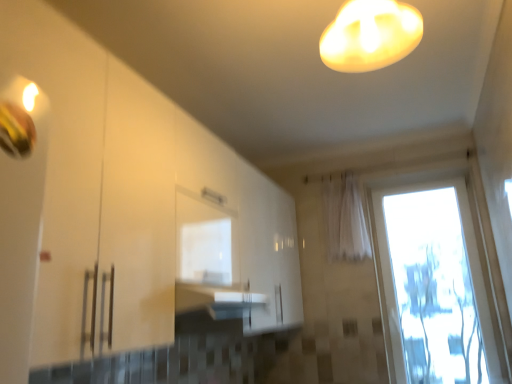
In order to click on transparent glass door at right in this screenshot , I will do `click(432, 281)`.

What is the approximate width of transparent glass door at right?

It is 6.27 inches.

Identify the location of white sheer curtain at center. The image size is (512, 384). (345, 218).

Find the location of a particular element. This screenshot has height=384, width=512. white glossy lampshade at upper center is located at coordinates (370, 35).

Is point (353, 176) positioned before point (368, 31)?

No, (353, 176) is behind (368, 31).

Is white sheer curtain at center taller than white glossy lampshade at upper center?

Correct, white sheer curtain at center is much taller as white glossy lampshade at upper center.

Is white glossy lampshade at upper center facing towards white glossy cabinet at center?

No, white glossy lampshade at upper center is not aimed at white glossy cabinet at center.

Consider the image. Which object is further away from the camera taking this photo, white glossy lampshade at upper center or white glossy cabinet at center?

Positioned behind is white glossy lampshade at upper center.

From a real-world perspective, which is physically above, white glossy lampshade at upper center or white glossy cabinet at center?

From a 3D spatial view, white glossy lampshade at upper center is above.

From a real-world perspective, is white glossy lampshade at upper center located beneath white sheer curtain at center?

No, from a real-world perspective, white glossy lampshade at upper center is not under white sheer curtain at center.

Considering the sizes of white glossy lampshade at upper center and white sheer curtain at center in the image, is white glossy lampshade at upper center bigger or smaller than white sheer curtain at center?

Clearly, white glossy lampshade at upper center is smaller in size than white sheer curtain at center.

Is white sheer curtain at center surrounded by white glossy lampshade at upper center?

No, white sheer curtain at center is not inside white glossy lampshade at upper center.

Which is farther from the camera, (397, 57) or (328, 224)?

The point (328, 224) is farther.

Is transparent glass door at right positioned before white sheer curtain at center?

Yes, transparent glass door at right is in front of white sheer curtain at center.

Measure the distance between transparent glass door at right and white sheer curtain at center.

18.47 inches.

Identify the location of curtain above the transparent glass door at right (from the image's perspective). (345, 218).

What's the angular difference between transparent glass door at right and white sheer curtain at center's facing directions?

The angle between the facing direction of transparent glass door at right and the facing direction of white sheer curtain at center is 0.324 degrees.

Between white glossy cabinet at center and white sheer curtain at center, which one appears on the right side from the viewer's perspective?

From the viewer's perspective, white sheer curtain at center appears more on the right side.

Is white glossy cabinet at center aimed at white sheer curtain at center?

Yes, white glossy cabinet at center is aimed at white sheer curtain at center.

Which of these two, white glossy cabinet at center or white sheer curtain at center, stands shorter?

With less height is white sheer curtain at center.

This screenshot has width=512, height=384. In order to click on curtain above the white glossy cabinet at center (from the image's perspective) in this screenshot , I will do `click(345, 218)`.

Measure the distance between transparent glass door at right and white glossy lampshade at upper center.

transparent glass door at right is 6.44 feet away from white glossy lampshade at upper center.

Is transparent glass door at right far from white glossy lampshade at upper center?

Yes, transparent glass door at right and white glossy lampshade at upper center are located far from each other.

From a real-world perspective, between transparent glass door at right and white glossy lampshade at upper center, who is vertically higher?

white glossy lampshade at upper center.

Is transparent glass door at right shorter than white glossy lampshade at upper center?

Incorrect, the height of transparent glass door at right does not fall short of that of white glossy lampshade at upper center.

From the image's perspective, which is below, white sheer curtain at center or transparent glass door at right?

From the image's view, transparent glass door at right is below.

Based on the photo, is the surface of white sheer curtain at center in direct contact with transparent glass door at right?

No, white sheer curtain at center is not next to transparent glass door at right.

Is white sheer curtain at center positioned with its back to transparent glass door at right?

No, transparent glass door at right is not at the back of white sheer curtain at center.

In order to click on curtain located below the white glossy lampshade at upper center (from the image's perspective) in this screenshot , I will do `click(345, 218)`.

You are a GUI agent. You are given a task and a screenshot of the screen. Output one action in this format:
    pyautogui.click(x=<x>, y=<y>)
    Task: Click on the cabinetry lying in front of the white glossy lampshade at upper center
    This screenshot has width=512, height=384.
    Given the screenshot: What is the action you would take?
    pyautogui.click(x=169, y=231)

When comparing their distances from transparent glass door at right, does white glossy cabinet at center or white glossy lampshade at upper center seem further?

white glossy lampshade at upper center is positioned further to the anchor transparent glass door at right.

When comparing their distances from white glossy lampshade at upper center, does white sheer curtain at center or transparent glass door at right seem further?

Based on the image, transparent glass door at right appears to be further to white glossy lampshade at upper center.

Estimate the real-world distances between objects in this image. Which object is further from white sheer curtain at center, transparent glass door at right or white glossy cabinet at center?

The object further to white sheer curtain at center is white glossy cabinet at center.

From the image, which object appears to be farther from white sheer curtain at center, white glossy lampshade at upper center or white glossy cabinet at center?

Based on the image, white glossy lampshade at upper center appears to be further to white sheer curtain at center.

Considering their positions, is transparent glass door at right positioned closer to white glossy cabinet at center than white sheer curtain at center?

white sheer curtain at center is positioned closer to the anchor white glossy cabinet at center.

Considering their positions, is white glossy lampshade at upper center positioned closer to white glossy cabinet at center than white sheer curtain at center?

white glossy lampshade at upper center.

When comparing their distances from white glossy lampshade at upper center, does white sheer curtain at center or white glossy cabinet at center seem closer?

white glossy cabinet at center is closer to white glossy lampshade at upper center.

Which object lies nearer to the anchor point transparent glass door at right, white glossy lampshade at upper center or white glossy cabinet at center?

white glossy cabinet at center.

Locate an element on the screen. The image size is (512, 384). window located between white glossy cabinet at center and white sheer curtain at center in the depth direction is located at coordinates (432, 281).

Image resolution: width=512 pixels, height=384 pixels. What are the coordinates of `lamp between white glossy cabinet at center and transparent glass door at right along the z-axis` in the screenshot? It's located at (370, 35).

The height and width of the screenshot is (384, 512). I want to click on window located between white glossy lampshade at upper center and white sheer curtain at center in the depth direction, so click(x=432, y=281).

The image size is (512, 384). What are the coordinates of `lamp between white glossy cabinet at center and white sheer curtain at center from front to back` in the screenshot? It's located at (370, 35).